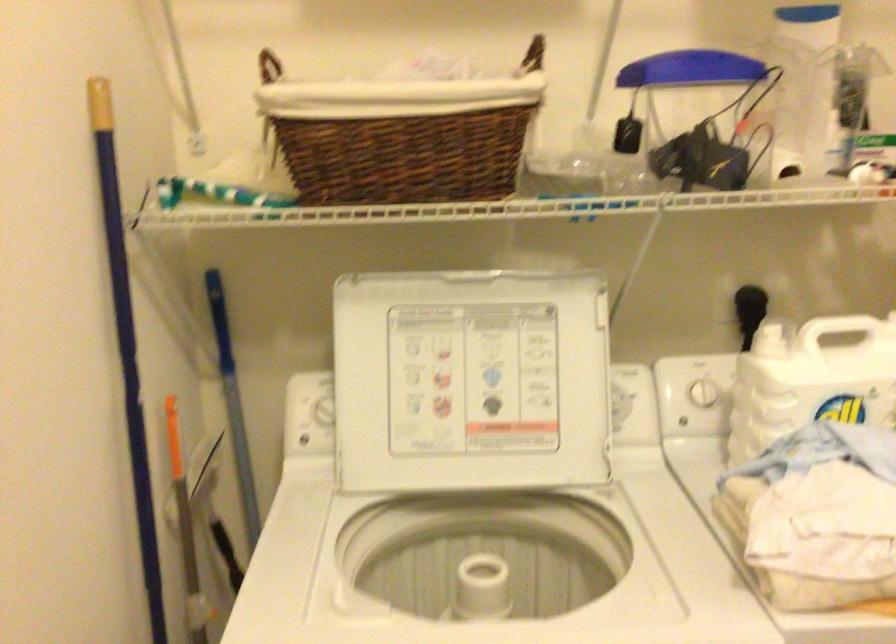
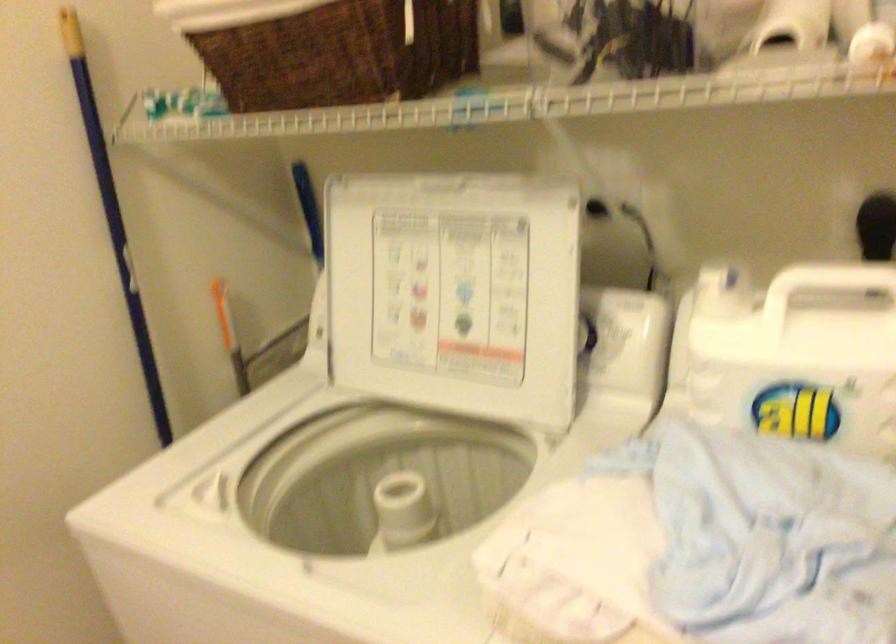
Find the pixel in the second image that matches (x=466, y=161) in the first image.

(340, 53)